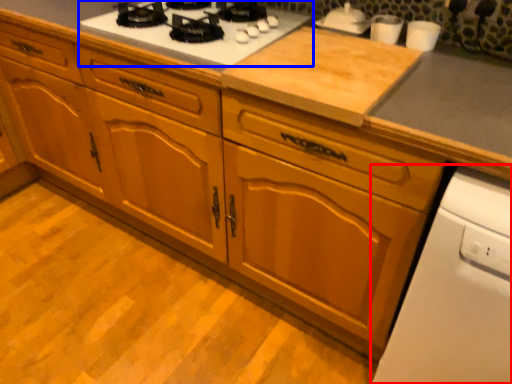
Question: Which point is closer to the camera, home appliance (highlighted by a red box) or gas stove (highlighted by a blue box)?

Choices:
 (A) home appliance
 (B) gas stove

Answer: (A)